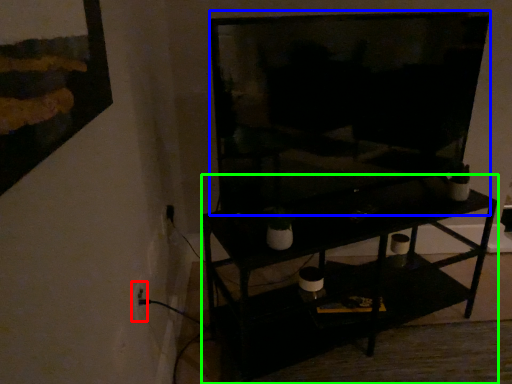
Question: Estimate the real-world distances between objects in this image. Which object is farther from electric outlet (highlighted by a red box), television (highlighted by a blue box) or shelf (highlighted by a green box)?

Choices:
 (A) television
 (B) shelf

Answer: (A)